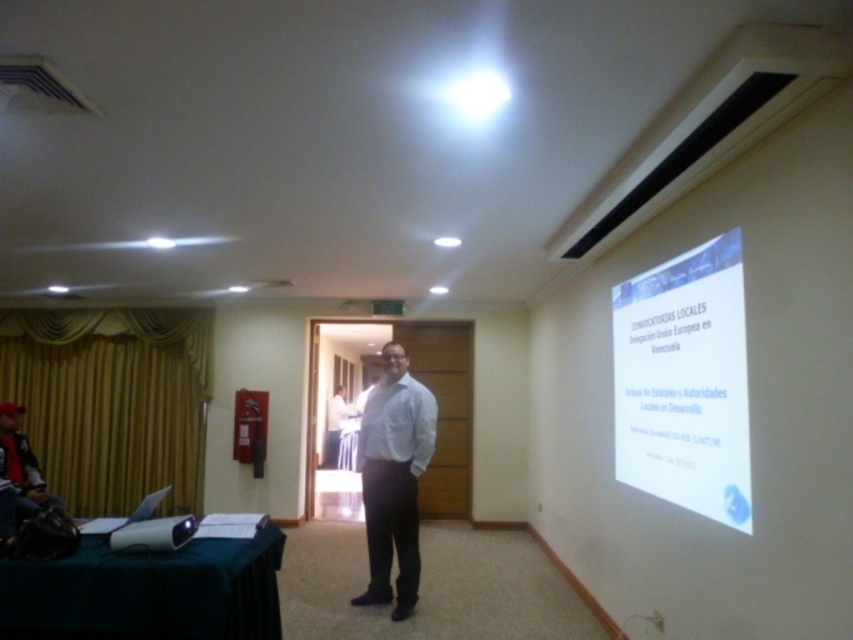
Question: Among these objects, which one is farthest from the camera?

Choices:
 (A) white matte shirt at center
 (B) white matte projector screen at upper right
 (C) dark gray jacket at left

Answer: (A)

Question: Is white matte projector screen at upper right smaller than white matte shirt at center?

Choices:
 (A) no
 (B) yes

Answer: (B)

Question: Which of the following is the farthest from the observer?

Choices:
 (A) (399, 516)
 (B) (641, 356)

Answer: (A)

Question: Which of the following is the farthest from the observer?

Choices:
 (A) white matte shirt at center
 (B) dark gray jacket at left
 (C) white matte projector screen at upper right

Answer: (A)

Question: Can you confirm if white matte projector screen at upper right is wider than dark gray jacket at left?

Choices:
 (A) no
 (B) yes

Answer: (A)

Question: In this image, where is white matte projector screen at upper right located relative to dark gray jacket at left?

Choices:
 (A) below
 (B) above

Answer: (B)